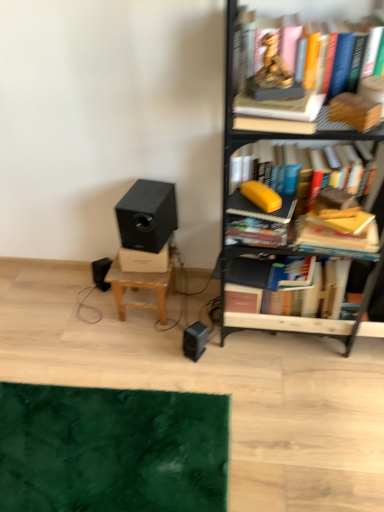
Question: From a real-world perspective, is gold statue at upper center, marked as the 1th book in a top-to-bottom arrangement, below yellow matte pencil case at upper right, which appears as the 2th book when viewed from the top?

Choices:
 (A) no
 (B) yes

Answer: (A)

Question: Does gold statue at upper center, marked as the 1th book in a top-to-bottom arrangement, turn towards yellow matte pencil case at upper right, which appears as the 2th book when viewed from the top?

Choices:
 (A) no
 (B) yes

Answer: (A)

Question: Is gold statue at upper center, marked as the 1th book in a top-to-bottom arrangement, positioned before yellow matte pencil case at upper right, which appears as the 2th book when viewed from the top?

Choices:
 (A) no
 (B) yes

Answer: (B)

Question: From a real-world perspective, is gold statue at upper center, placed as the 4th book when sorted from bottom to top, positioned over yellow matte pencil case at upper right, the 3th book ordered from the bottom, based on gravity?

Choices:
 (A) yes
 (B) no

Answer: (A)

Question: Considering the relative sizes of gold statue at upper center, placed as the 4th book when sorted from bottom to top, and yellow matte pencil case at upper right, which appears as the 2th book when viewed from the top, in the image provided, is gold statue at upper center, placed as the 4th book when sorted from bottom to top, wider than yellow matte pencil case at upper right, which appears as the 2th book when viewed from the top,?

Choices:
 (A) yes
 (B) no

Answer: (A)

Question: Is gold statue at upper center, placed as the 4th book when sorted from bottom to top, turned away from yellow matte pencil case at upper right, which appears as the 2th book when viewed from the top?

Choices:
 (A) yes
 (B) no

Answer: (B)

Question: Is metallic black bookcase at right bigger than black matte speaker at center-left?

Choices:
 (A) yes
 (B) no

Answer: (A)

Question: From a real-world perspective, is metallic black bookcase at right physically above black matte speaker at center-left?

Choices:
 (A) yes
 (B) no

Answer: (A)

Question: Is the position of metallic black bookcase at right more distant than that of black matte speaker at center-left?

Choices:
 (A) no
 (B) yes

Answer: (A)

Question: From the image's perspective, is metallic black bookcase at right over black matte speaker at center-left?

Choices:
 (A) no
 (B) yes

Answer: (B)

Question: Would you say metallic black bookcase at right is a long distance from black matte speaker at center-left?

Choices:
 (A) yes
 (B) no

Answer: (B)

Question: Is metallic black bookcase at right oriented towards black matte speaker at center-left?

Choices:
 (A) no
 (B) yes

Answer: (A)

Question: Does metallic black bookcase at right have a lesser width compared to hardcover book at center right, the 1th book ordered from the bottom?

Choices:
 (A) no
 (B) yes

Answer: (A)